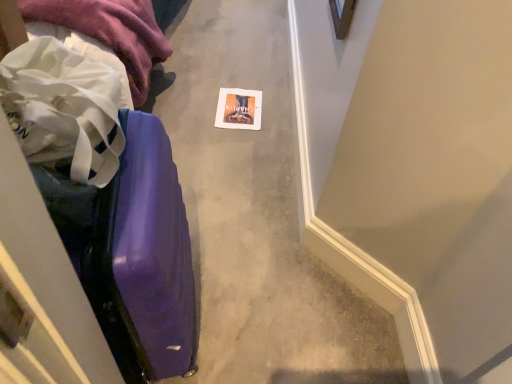
Question: Based on their sizes in the image, would you say white fabric at left is bigger or smaller than matte paper postcard at center?

Choices:
 (A) small
 (B) big

Answer: (B)

Question: From a real-world perspective, relative to matte paper postcard at center, is white fabric at left vertically above or below?

Choices:
 (A) above
 (B) below

Answer: (A)

Question: Estimate the real-world distances between objects in this image. Which object is closer to the purple glossy suitcase at left?

Choices:
 (A) white fabric at left
 (B) matte paper postcard at center

Answer: (A)

Question: Considering the real-world distances, which object is closest to the purple glossy suitcase at left?

Choices:
 (A) matte paper postcard at center
 (B) white fabric at left

Answer: (B)